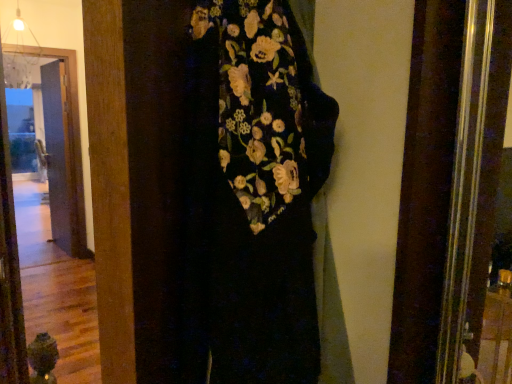
Describe the element at coordinates (258, 192) in the screenshot. Image resolution: width=512 pixels, height=384 pixels. I see `velvet floral dress at center` at that location.

Where is `velvet floral dress at center`? velvet floral dress at center is located at coordinates (258, 192).

You are a GUI agent. You are given a task and a screenshot of the screen. Output one action in this format:
    pyautogui.click(x=<x>, y=<y>)
    Task: Click on the velvet floral dress at center
    This screenshot has width=512, height=384.
    Given the screenshot: What is the action you would take?
    pyautogui.click(x=258, y=192)